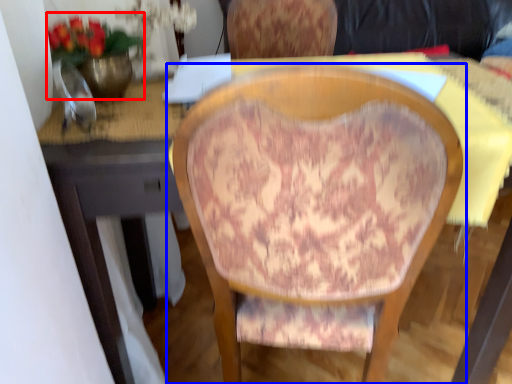
Question: Which object is closer to the camera taking this photo, floral arrangement (highlighted by a red box) or chair (highlighted by a blue box)?

Choices:
 (A) floral arrangement
 (B) chair

Answer: (B)